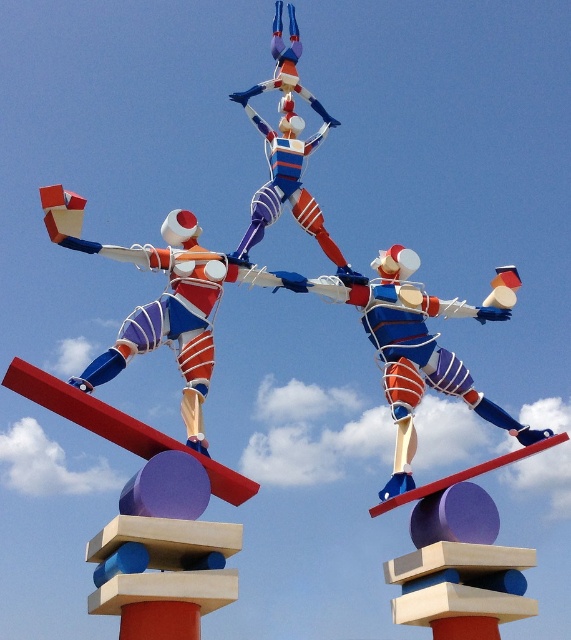
Is point (195, 296) positioned after point (295, 124)?

No, it is in front of (295, 124).

Locate an element on the screen. This screenshot has height=640, width=571. matte plastic figure at center is located at coordinates (155, 301).

This screenshot has width=571, height=640. Find the location of `matte plastic figure at center`. matte plastic figure at center is located at coordinates (155, 301).

Who is positioned more to the left, metallic blue and white figure at center or matte plastic figure at center?

matte plastic figure at center is more to the left.

Can you confirm if metallic blue and white figure at center is taller than matte plastic figure at center?

Yes.

Locate an element on the screen. metallic blue and white figure at center is located at coordinates (411, 353).

Can you confirm if metallic blue and white figure at center is shorter than shiny metallic figure at center?

Incorrect, metallic blue and white figure at center's height does not fall short of shiny metallic figure at center's.

Does point (404, 452) lie in front of point (333, 257)?

Yes, it is.

In order to click on metallic blue and white figure at center in this screenshot , I will do `click(411, 353)`.